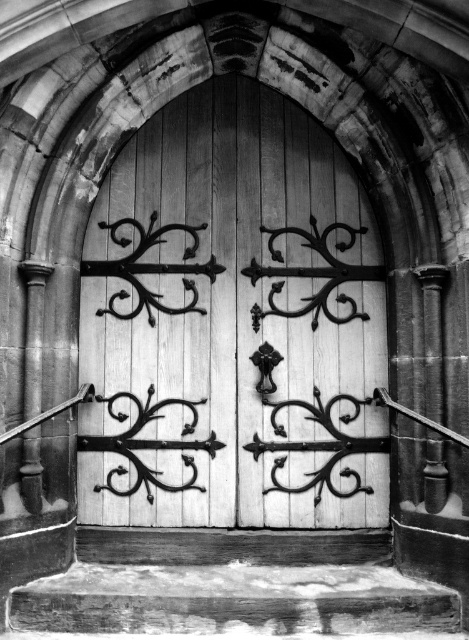
You are standing in front of the wooden doors with intricate ironwork. There are two points marked on the doors. One is at coordinate point (316,358) and the other at point (269,595). If you want to touch the point that is closer to you, which coordinate should you aim for?

You should aim for point (269,595) because it is closer to you than point (316,358).

Based on the photo, you are a delivery person trying to move a large box through the doors. The box is 1.2 meters wide. The white wood door at center and wooden at lower center are both closed. Which door can the box fit through?

The wooden at lower center has a greater width than the white wood door at center, so the box can fit through the wooden at lower center since its width is larger than 1.2 meters.

You are standing in front of the wooden doors of a historic building. You notice a specific point marked at coordinates point (x=233, y=323). Can you identify which part of the white wood door at center is located at this point?

The white wood door at center is located at point (x=233, y=323), so the point is on the white wood door at center.